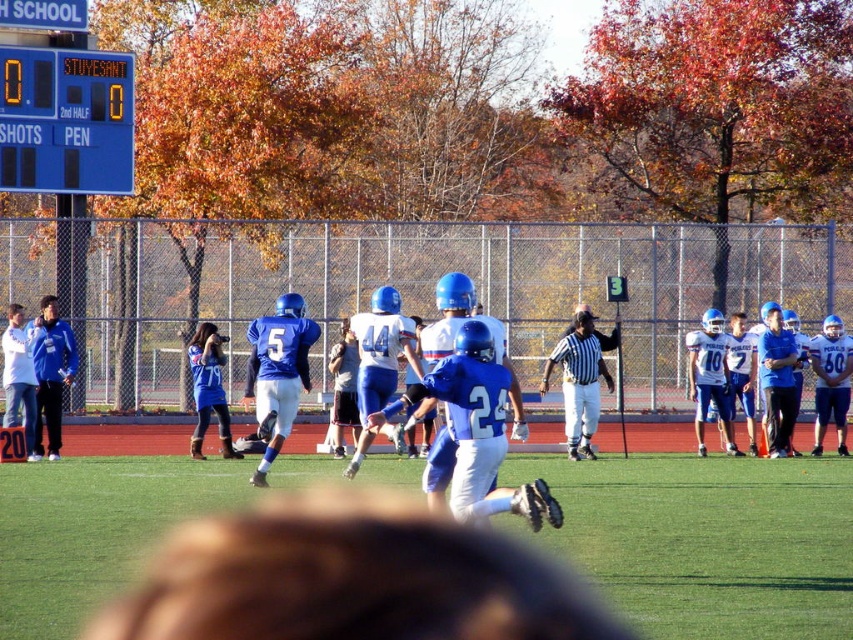
You are standing at the edge of the green grass football field at center. A teammate shouts that they are 10 meters away from you. Can you confirm if they are within your line of sight?

The green grass football field at center is 9.63 meters away from the viewer. Since the teammate is 10 meters away, they are slightly further than the field itself, so they might be just out of immediate line of sight or require a closer look.

You are a spectator at the football game and want to take a photo of the green grass football field at center without the blue plastic scoreboard at upper left blocking the view. Is this possible?

The green grass football field at center is positioned under the blue plastic scoreboard at upper left, so if you angle your camera downward or move to a lower vantage point, you can capture the field without the scoreboard obstructing the view.

Consider the image. You are a spectator at the football game and want to take a photo that includes both the green grass football field at center and the blue matte uniform at right. Which object should you focus on first to ensure both are in the frame?

You should focus on the green grass football field at center first because it is larger in size than the blue matte uniform at right, so it will take up more space in the photo.